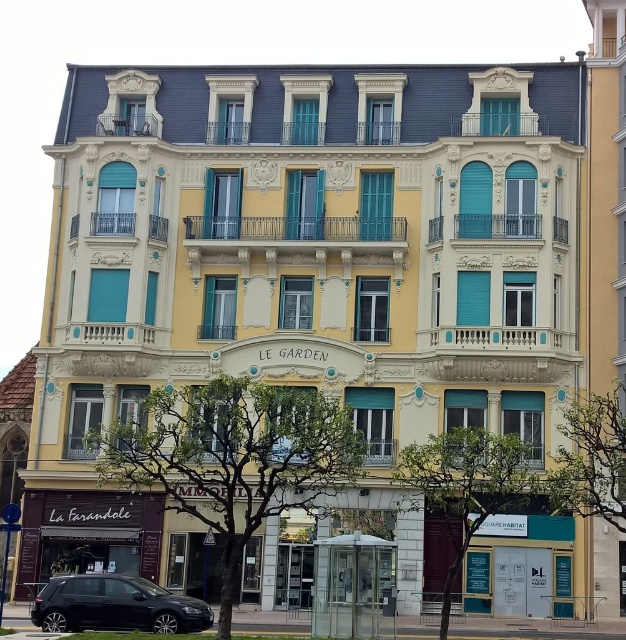
Measure the distance between yellow matte building at right and shiny black car at lower left.

yellow matte building at right and shiny black car at lower left are 24.77 meters apart from each other.

Which is above, yellow matte building at right or shiny black car at lower left?

yellow matte building at right

Is point (595, 140) farther from camera compared to point (85, 586)?

Yes, it is.

The image size is (626, 640). I want to click on yellow matte building at right, so click(603, 198).